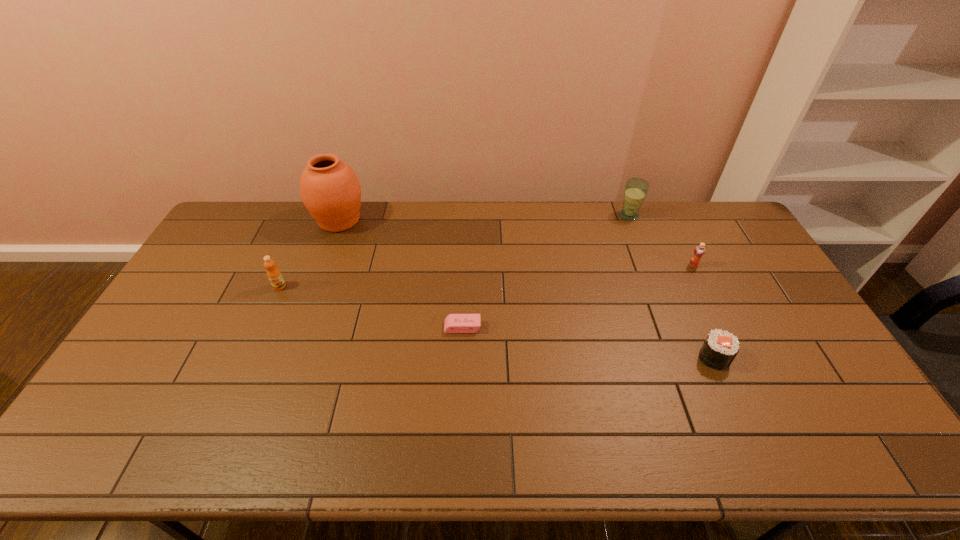
Identify the location of blank region between the glass and the third shortest object. (661, 240).

Where is `free spot between the fourth tallest object and the tallest object`? The image size is (960, 540). free spot between the fourth tallest object and the tallest object is located at coordinates (516, 243).

The height and width of the screenshot is (540, 960). I want to click on the third closest object relative to the urn, so click(635, 191).

In order to click on object that stands as the fourth closest to the urn in this screenshot , I will do `click(719, 349)`.

Identify the location of free spot that satisfies the following two spatial constraints: 1. on the front side of the glass; 2. on the right side of the third farthest object. (649, 266).

I want to click on free space that satisfies the following two spatial constraints: 1. on the front label of the fifth tallest object; 2. on the left side of the left orange juice, so tap(248, 357).

Where is `vacant space that satisfies the following two spatial constraints: 1. on the front label of the fourth object from right to left; 2. on the left side of the third nearest object`? This screenshot has height=540, width=960. vacant space that satisfies the following two spatial constraints: 1. on the front label of the fourth object from right to left; 2. on the left side of the third nearest object is located at coordinates (261, 327).